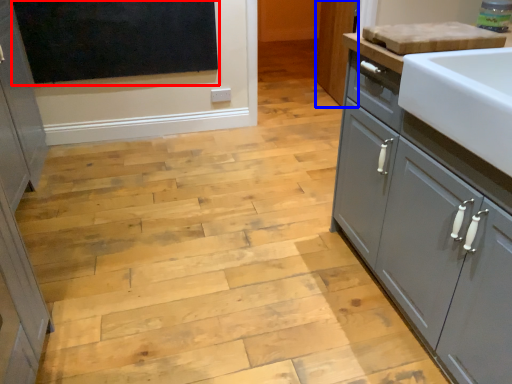
Question: Among these objects, which one is nearest to the camera, window screen (highlighted by a red box) or cabinetry (highlighted by a blue box)?

Choices:
 (A) window screen
 (B) cabinetry

Answer: (A)